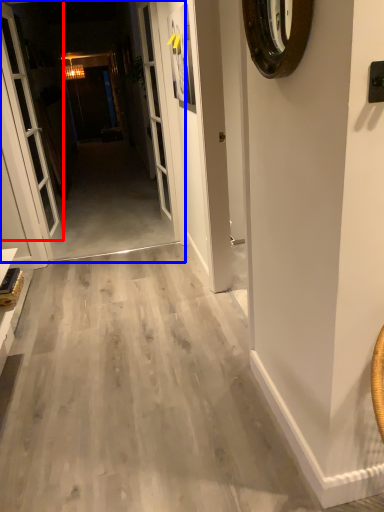
Question: Which object is further to the camera taking this photo, door (highlighted by a red box) or corridor (highlighted by a blue box)?

Choices:
 (A) door
 (B) corridor

Answer: (B)